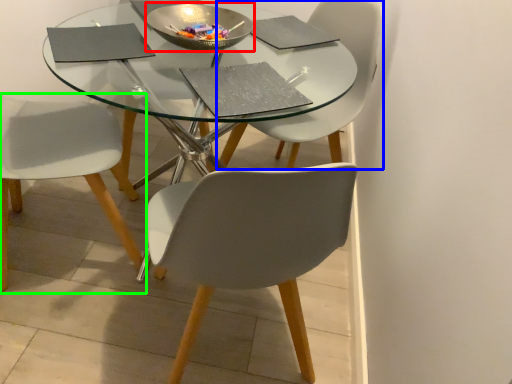
Question: Which is nearer to the bowl (highlighted by a red box)? chair (highlighted by a blue box) or chair (highlighted by a green box).

Choices:
 (A) chair
 (B) chair

Answer: (A)